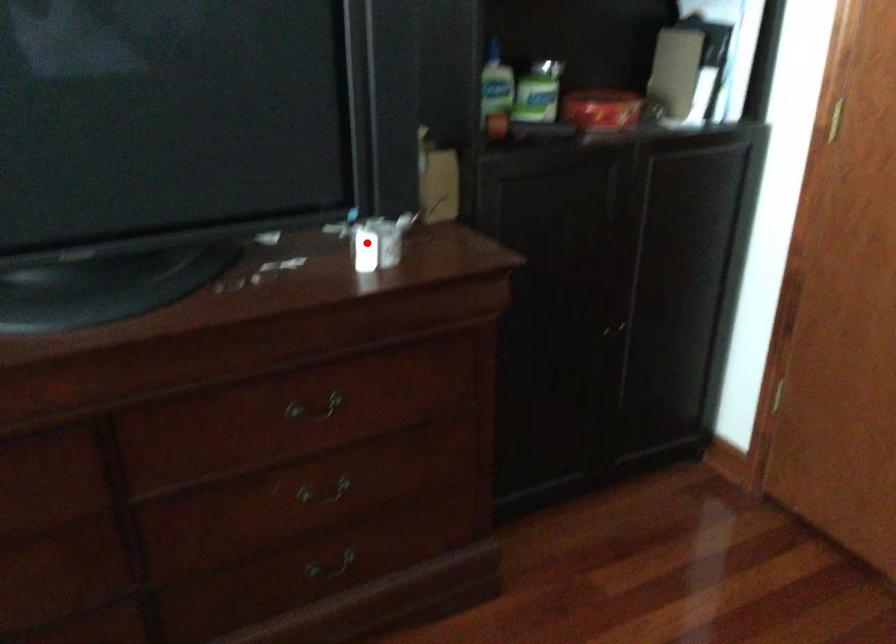
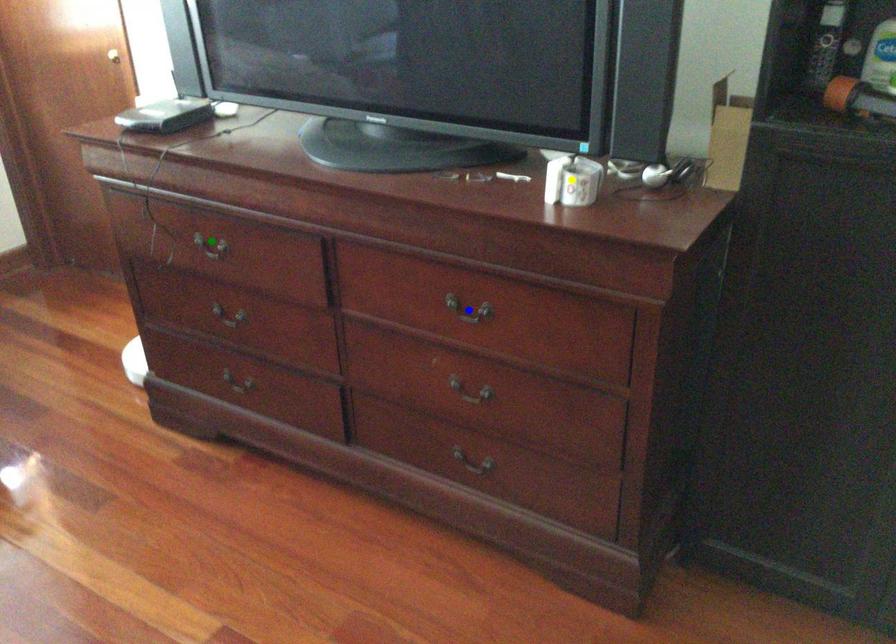
Question: I am providing you with two images of the same scene from different viewpoints. A red point is marked on the first image. You are given multiple points on the second image. Can you choose the point in image 2 that corresponds to the point in image 1?

Choices:
 (A) yellow point
 (B) green point
 (C) blue point

Answer: (A)